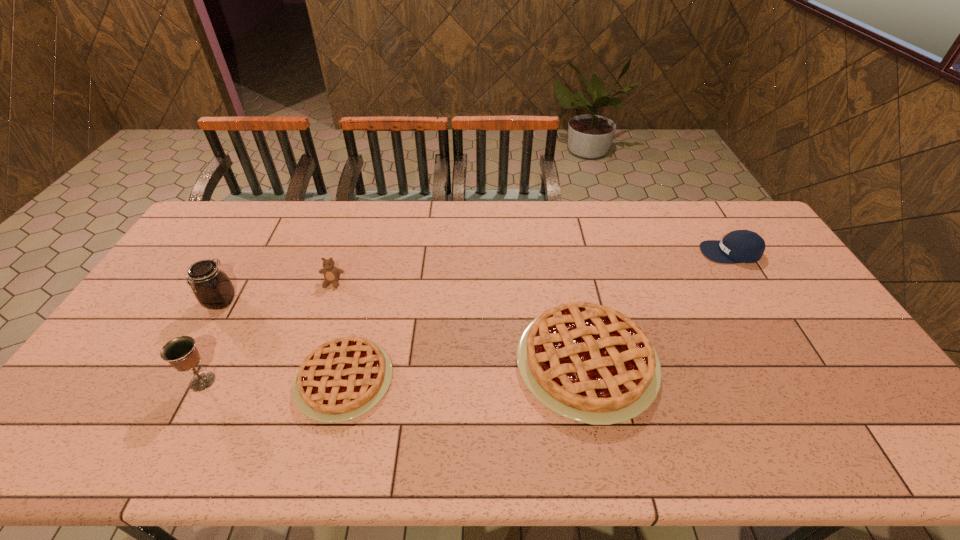
In the current image, all pies are evenly spaced. To maintain this equal spacing, where should an additional pie be placed on the right? Please point out a free spot. Please provide its 2D coordinates. Your answer should be formatted as a tuple, i.e. [(x, y)], where the tuple contains the x and y coordinates of a point satisfying the conditions above.

[(813, 347)]